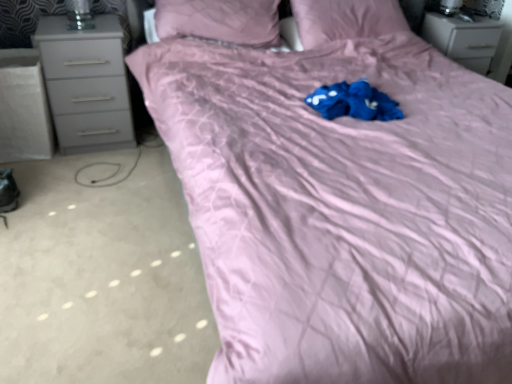
Question: Does gray matte chest of drawers at left, the first chest of drawers in the front-to-back sequence, have a smaller size compared to matte pink pillow at upper center, which is the first pillow in left-to-right order?

Choices:
 (A) no
 (B) yes

Answer: (B)

Question: Is gray matte chest of drawers at left, acting as the second chest of drawers starting from the right, not near matte pink pillow at upper center, which is the first pillow in left-to-right order?

Choices:
 (A) no
 (B) yes

Answer: (A)

Question: Would you say gray matte chest of drawers at left, placed as the 1th chest of drawers when sorted from left to right, is outside matte pink pillow at upper center, the second pillow positioned from the right?

Choices:
 (A) yes
 (B) no

Answer: (A)

Question: Is gray matte chest of drawers at left, which is counted as the second chest of drawers, starting from the back, beside matte pink pillow at upper center, the second pillow positioned from the right?

Choices:
 (A) yes
 (B) no

Answer: (B)

Question: Does gray matte chest of drawers at left, which is counted as the second chest of drawers, starting from the back, turn towards matte pink pillow at upper center, the second pillow positioned from the right?

Choices:
 (A) no
 (B) yes

Answer: (A)

Question: Considering the positions of matte pink pillow at upper center, which ranks as the 2th pillow in left-to-right order, and matte gray chest of drawers at upper right, the 2th chest of drawers when ordered from left to right, in the image, is matte pink pillow at upper center, which ranks as the 2th pillow in left-to-right order, taller or shorter than matte gray chest of drawers at upper right, the 2th chest of drawers when ordered from left to right,?

Choices:
 (A) short
 (B) tall

Answer: (A)

Question: Is point (391, 26) positioned closer to the camera than point (489, 39)?

Choices:
 (A) closer
 (B) farther

Answer: (A)

Question: Considering the positions of matte pink pillow at upper center, positioned as the first pillow in right-to-left order, and matte gray chest of drawers at upper right, the 2th chest of drawers when ordered from left to right, in the image, is matte pink pillow at upper center, positioned as the first pillow in right-to-left order, wider or thinner than matte gray chest of drawers at upper right, the 2th chest of drawers when ordered from left to right,?

Choices:
 (A) wide
 (B) thin

Answer: (B)

Question: From a real-world perspective, is matte pink pillow at upper center, positioned as the first pillow in right-to-left order, positioned above or below matte gray chest of drawers at upper right, the 2th chest of drawers when ordered from left to right?

Choices:
 (A) below
 (B) above

Answer: (B)

Question: Would you say matte gray chest of drawers at upper right, the 2th chest of drawers when ordered from left to right, is to the left or to the right of matte pink pillow at upper center, which ranks as the 2th pillow in left-to-right order, in the picture?

Choices:
 (A) left
 (B) right

Answer: (B)

Question: Is matte gray chest of drawers at upper right, marked as the first chest of drawers in a right-to-left arrangement, inside or outside of matte pink pillow at upper center, which ranks as the 2th pillow in left-to-right order?

Choices:
 (A) outside
 (B) inside

Answer: (A)

Question: Considering the positions of matte gray chest of drawers at upper right, marked as the first chest of drawers in a right-to-left arrangement, and matte pink pillow at upper center, which ranks as the 2th pillow in left-to-right order, in the image, is matte gray chest of drawers at upper right, marked as the first chest of drawers in a right-to-left arrangement, taller or shorter than matte pink pillow at upper center, which ranks as the 2th pillow in left-to-right order,?

Choices:
 (A) short
 (B) tall

Answer: (B)

Question: Is point (433, 26) closer or farther from the camera than point (292, 46)?

Choices:
 (A) closer
 (B) farther

Answer: (B)

Question: In terms of height, does matte pink pillow at upper center, which ranks as the 2th pillow in left-to-right order, look taller or shorter compared to matte pink pillow at upper center, the second pillow positioned from the right?

Choices:
 (A) short
 (B) tall

Answer: (A)

Question: Considering the positions of matte pink pillow at upper center, which ranks as the 2th pillow in left-to-right order, and matte pink pillow at upper center, which is the first pillow in left-to-right order, in the image, is matte pink pillow at upper center, which ranks as the 2th pillow in left-to-right order, wider or thinner than matte pink pillow at upper center, which is the first pillow in left-to-right order,?

Choices:
 (A) thin
 (B) wide

Answer: (A)